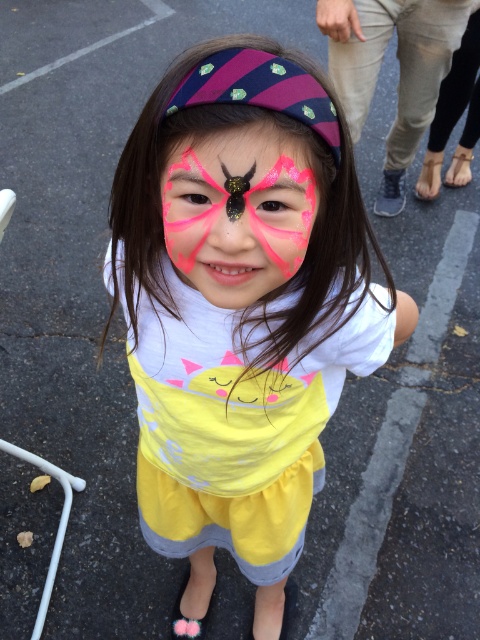
Question: Can you confirm if matte white shirt at center is smaller than pink glitter butterfly at center?

Choices:
 (A) no
 (B) yes

Answer: (A)

Question: Which object appears farthest from the camera in this image?

Choices:
 (A) matte white shirt at center
 (B) pink glitter butterfly at center

Answer: (B)

Question: Is matte white shirt at center smaller than pink glitter butterfly at center?

Choices:
 (A) yes
 (B) no

Answer: (B)

Question: Can you confirm if matte white shirt at center is positioned to the left of pink glitter butterfly at center?

Choices:
 (A) yes
 (B) no

Answer: (B)